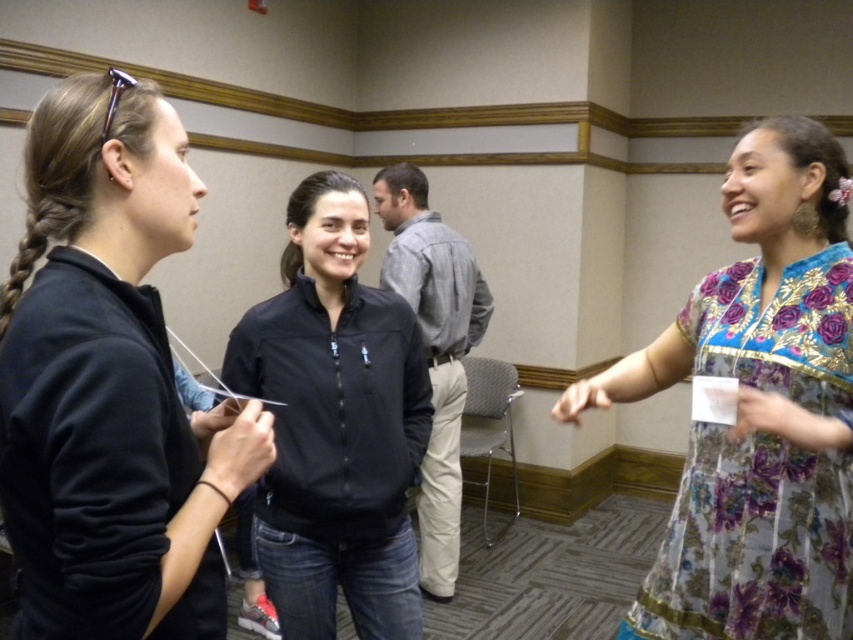
You are organizing a photo shoot and need to arrange two outfits for a catalog. The floral silk dress at right and the black softshell jacket at center are part of the collection. Based on their sizes, which outfit would you recommend for a model who prefers wearing taller garments?

The black softshell jacket at center is taller than the floral silk dress at right, so it would be the better choice for a model preferring taller garments.

You are standing in the conference room and need to pass a document to the person in the gray cotton shirt at center from the matte black jacket at left. Given that the average human arm can reach about 2.5 feet, can you hand them the document without moving closer?

The distance between the matte black jacket at left and gray cotton shirt at center is 6.53 feet, which is significantly longer than the average human arm reach of 2.5 feet. Therefore, you cannot hand the document without moving closer.